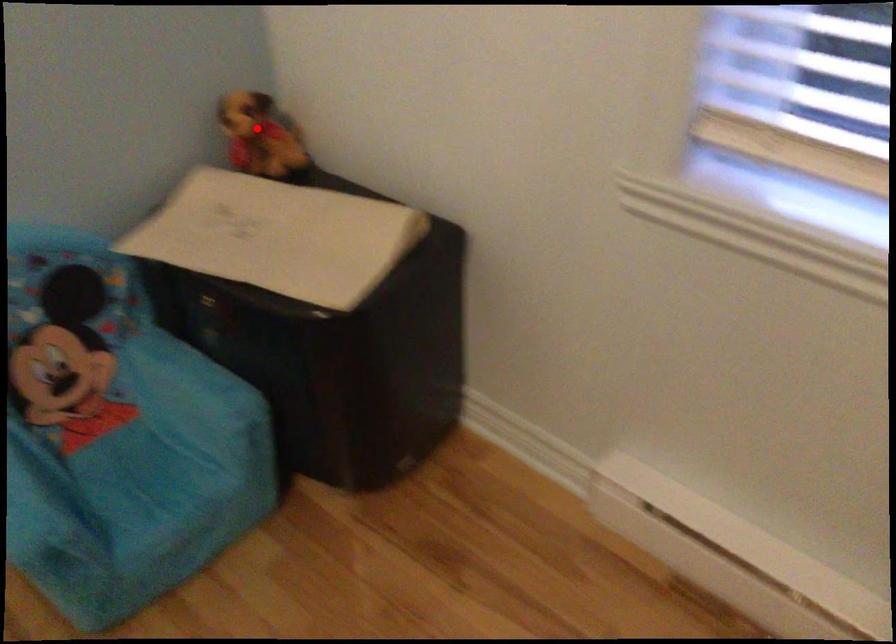
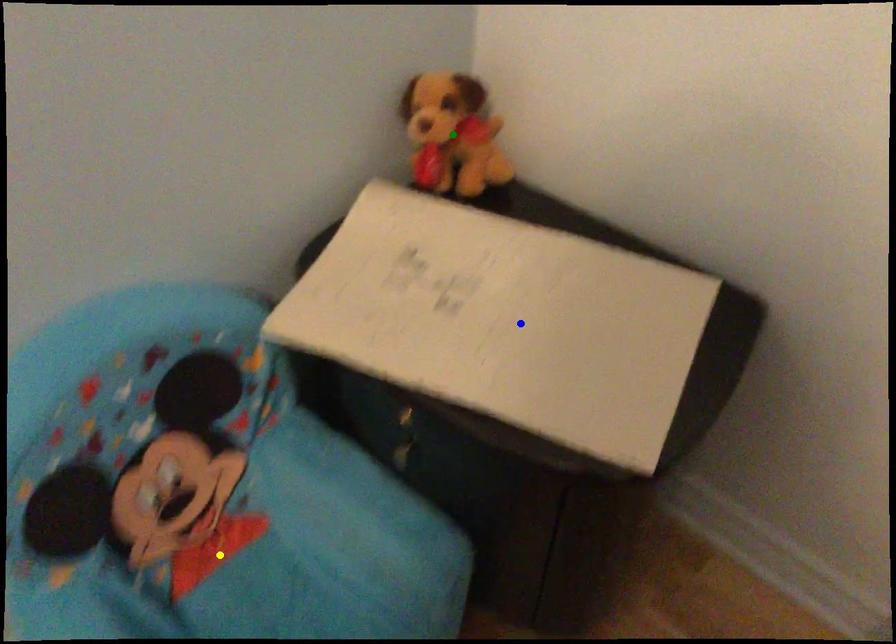
Question: I am providing you with two images of the same scene from different viewpoints. A red point is marked on the first image. You are given multiple points on the second image. Can you choose the point in image 2 that corresponds to the point in image 1?

Choices:
 (A) blue point
 (B) green point
 (C) yellow point

Answer: (B)